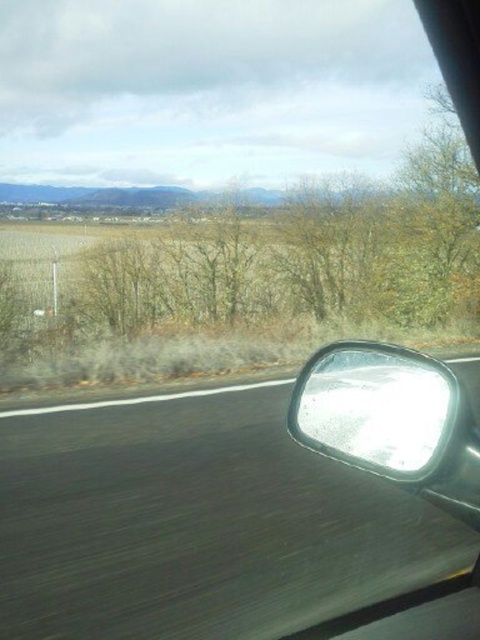
You are driving a car and want to know how far the brown leafless tree at center is from your car. Can you determine the distance?

The brown leafless tree at center is 9.02 meters away from the camera, so it is approximately 9 meters away from the car.

You are a driver checking the road ahead. You notice the brown leafless tree at center and the glossy metallic rearview mirror at lower right. Which object is wider from your perspective?

The brown leafless tree at center is wider than the glossy metallic rearview mirror at lower right according to the description.

Based on the photo, you are a driver who wants to know if the brown leafless tree at center is within a safe distance from the glossy metallic rearview mirror at lower right. The safety guideline states that objects must be at least 60 feet away. Can you confirm if this is the case?

The distance between the brown leafless tree at center and the glossy metallic rearview mirror at lower right is 57.32 feet, which is less than the required 60 feet safety guideline. Therefore, the tree is too close to be considered safe.